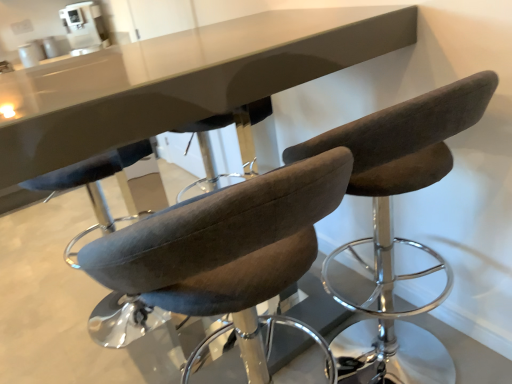
Question: Is velvet brown stool at center, the 2th chair from the right, positioned behind dark brown fabric chair at center, positioned as the first chair in right-to-left order?

Choices:
 (A) yes
 (B) no

Answer: (B)

Question: Considering the relative positions of velvet brown stool at center, the 1th chair viewed from the left, and dark brown fabric chair at center, positioned as the first chair in right-to-left order, in the image provided, is velvet brown stool at center, the 1th chair viewed from the left, to the right of dark brown fabric chair at center, positioned as the first chair in right-to-left order, from the viewer's perspective?

Choices:
 (A) no
 (B) yes

Answer: (A)

Question: Can you confirm if velvet brown stool at center, the 1th chair viewed from the left, is taller than dark brown fabric chair at center, positioned as the first chair in right-to-left order?

Choices:
 (A) no
 (B) yes

Answer: (A)

Question: Is velvet brown stool at center, the 2th chair from the right, oriented away from dark brown fabric chair at center, acting as the second chair starting from the left?

Choices:
 (A) no
 (B) yes

Answer: (A)

Question: Considering the relative sizes of velvet brown stool at center, the 2th chair from the right, and dark brown fabric chair at center, acting as the second chair starting from the left, in the image provided, is velvet brown stool at center, the 2th chair from the right, bigger than dark brown fabric chair at center, acting as the second chair starting from the left,?

Choices:
 (A) no
 (B) yes

Answer: (B)

Question: From the image's perspective, is velvet brown stool at center, the 1th chair viewed from the left, located above or below white plastic coffee machine at upper center?

Choices:
 (A) below
 (B) above

Answer: (A)

Question: In terms of width, does velvet brown stool at center, the 1th chair viewed from the left, look wider or thinner when compared to white plastic coffee machine at upper center?

Choices:
 (A) wide
 (B) thin

Answer: (A)

Question: Considering their positions, is velvet brown stool at center, the 1th chair viewed from the left, located in front of or behind white plastic coffee machine at upper center?

Choices:
 (A) front
 (B) behind

Answer: (A)

Question: From their relative heights in the image, would you say velvet brown stool at center, the 1th chair viewed from the left, is taller or shorter than white plastic coffee machine at upper center?

Choices:
 (A) tall
 (B) short

Answer: (A)

Question: Is white plastic coffee machine at upper center wider or thinner than dark brown fabric chair at center, positioned as the first chair in right-to-left order?

Choices:
 (A) wide
 (B) thin

Answer: (B)

Question: From a real-world perspective, is white plastic coffee machine at upper center physically located above or below dark brown fabric chair at center, acting as the second chair starting from the left?

Choices:
 (A) below
 (B) above

Answer: (B)

Question: Is point (100, 29) closer or farther from the camera than point (355, 125)?

Choices:
 (A) farther
 (B) closer

Answer: (A)

Question: Relative to dark brown fabric chair at center, positioned as the first chair in right-to-left order, is white plastic coffee machine at upper center in front or behind?

Choices:
 (A) behind
 (B) front

Answer: (A)

Question: Considering their positions, is dark brown fabric chair at center, positioned as the first chair in right-to-left order, located in front of or behind white plastic coffee machine at upper center?

Choices:
 (A) front
 (B) behind

Answer: (A)

Question: Does point (463, 79) appear closer or farther from the camera than point (79, 54)?

Choices:
 (A) closer
 (B) farther

Answer: (A)